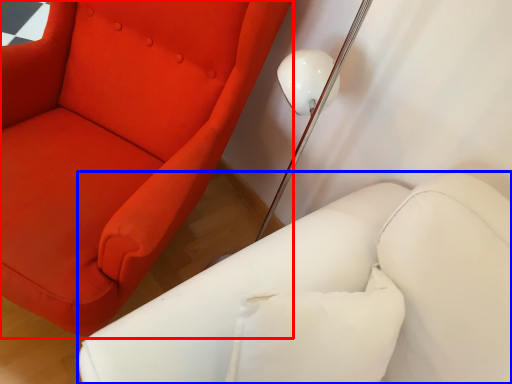
Question: Which of the following is the closest to the observer, chair (highlighted by a red box) or furniture (highlighted by a blue box)?

Choices:
 (A) chair
 (B) furniture

Answer: (B)